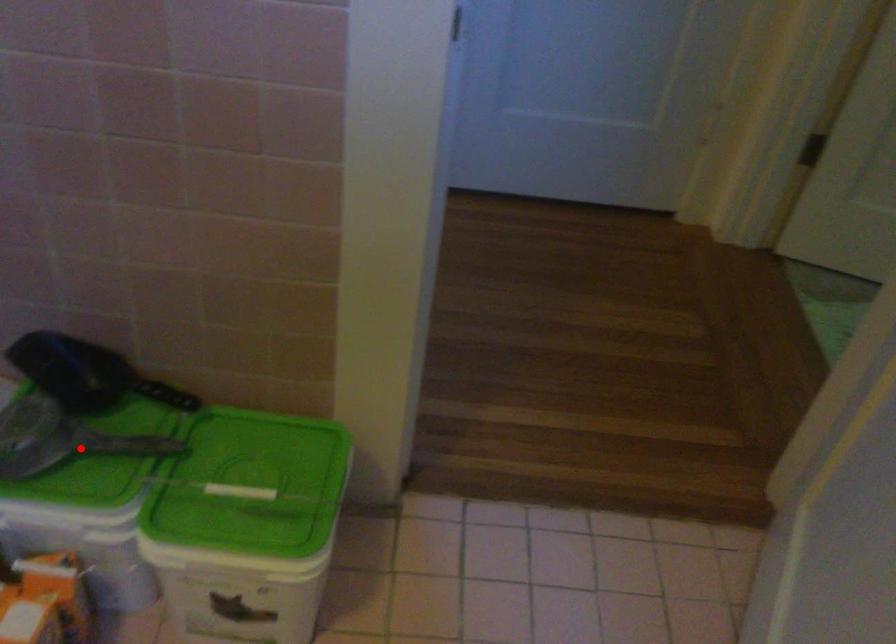
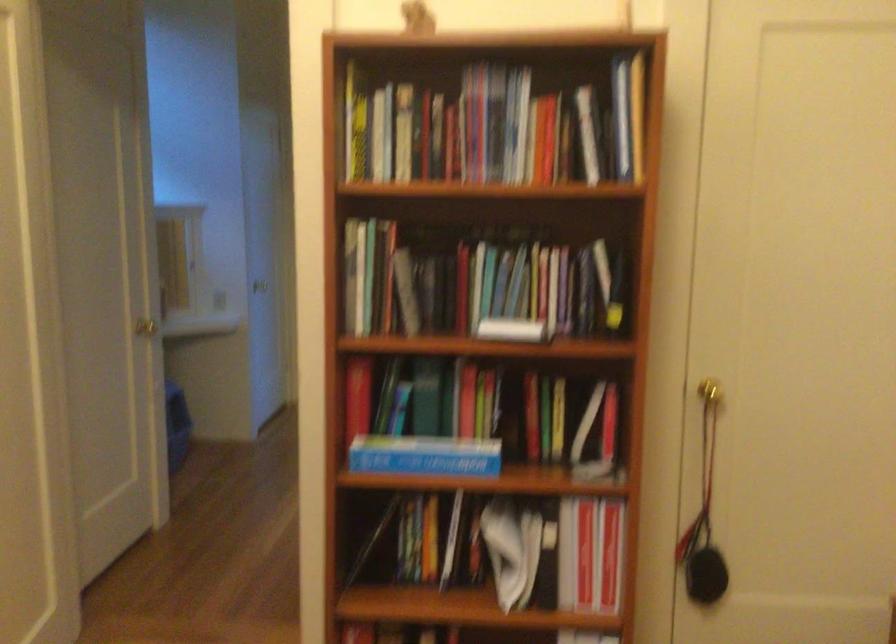
Question: I am providing you with two images of the same scene from different viewpoints. A red point is marked on the first image. Is the red point's position out of view in image 2?

Choices:
 (A) Yes
 (B) No

Answer: (A)